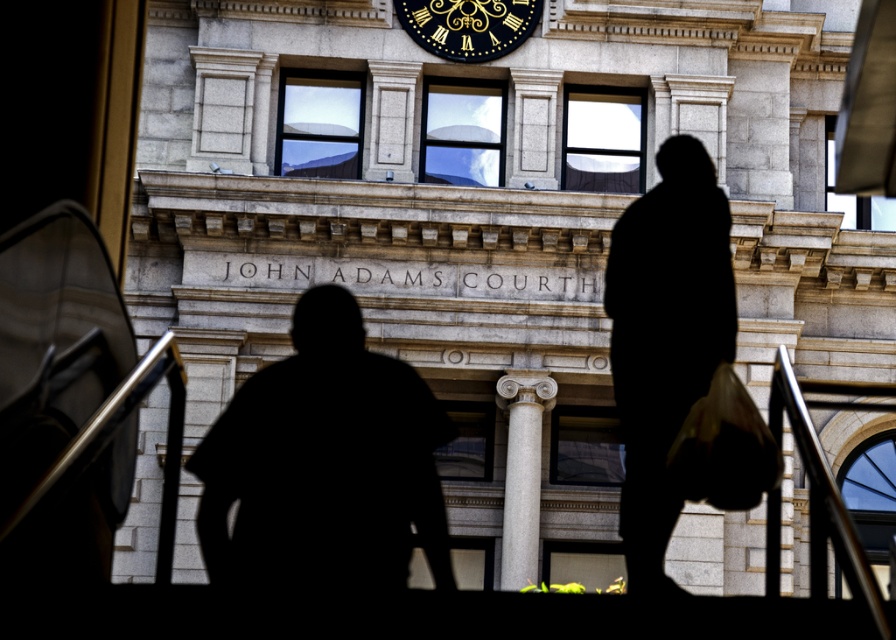
You are standing on the escalator and see the two black silhouette at center. How far apart are they?

The two black silhouette at center are 43.29 meters apart.

You are standing on the escalator and see the point marked at coordinates (324, 467). What object or feature does this point correspond to in the scene?

The point at coordinates (324, 467) corresponds to the black silhouette at center, indicating the location of a person using the escalator.

You are standing on the escalator and looking at two points marked on the building facade. The points are labeled as point 1 at coordinates (338, 488) and point 2 at coordinates (679, 378). Which point is closer to you?

Point 1 at coordinates (338, 488) is closer to you because it is further to the camera than point 2 at coordinates (679, 378).